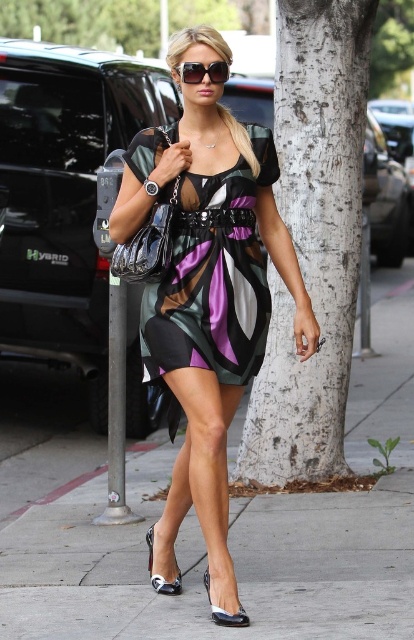
You are a delivery person who needs to deliver a package to the woman walking on the smooth concrete sidewalk at center. There is a white bark tree at upper center above her path. To avoid hitting the tree, how should you adjust your delivery route?

The smooth concrete sidewalk at center is below the white bark tree at upper center, so you should adjust your delivery route to stay on the sidewalk to avoid hitting the tree above.

You are a pedestrian standing on the smooth concrete sidewalk at center. You want to step onto the shiny black sandal at lower center. Is the sidewalk above or below the sandal?

The smooth concrete sidewalk at center is positioned over the shiny black sandal at lower center, so the sidewalk is above the sandal.